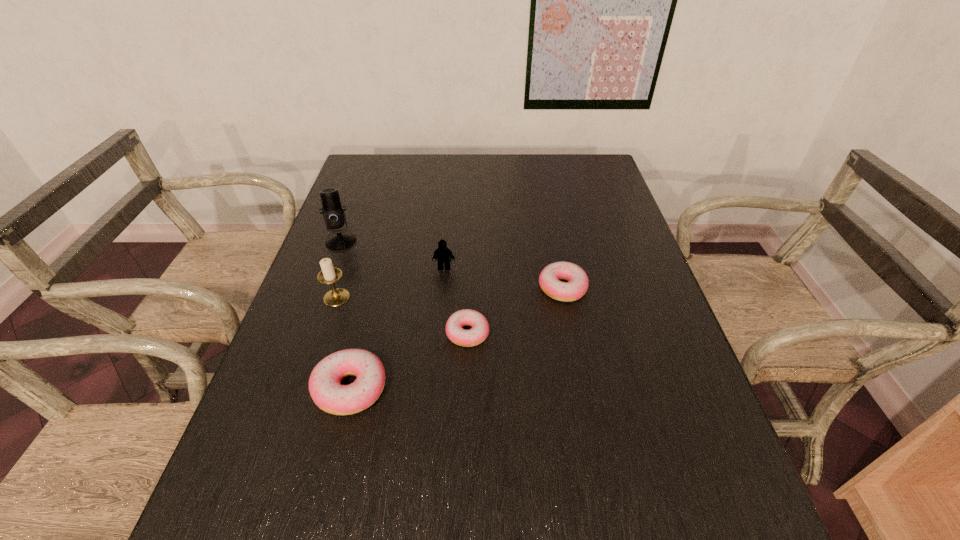
Find the location of a particular element. The height and width of the screenshot is (540, 960). the fifth nearest object is located at coordinates (442, 255).

The image size is (960, 540). What are the coordinates of `vacant area located 0.240m on the right of the nearest doughnut` in the screenshot? It's located at (503, 389).

Where is `free space located on the front of the second doughnut from right to left`? The image size is (960, 540). free space located on the front of the second doughnut from right to left is located at coordinates (466, 406).

What are the coordinates of `free space located on the front of the second shortest object` in the screenshot? It's located at (592, 442).

Find the location of a particular element. vacant space located on the back of the candle holder is located at coordinates (357, 235).

At what (x,y) coordinates should I click in order to perform the action: click on vacant point located 0.070m on the stand of the tallest object. Please return your answer as a coordinate pair (x, y). The image size is (960, 540). Looking at the image, I should click on (331, 267).

At what (x,y) coordinates should I click in order to perform the action: click on vacant area located 0.100m on the face of the second farthest object. Please return your answer as a coordinate pair (x, y). Looking at the image, I should click on (442, 297).

Find the location of a particular element. This screenshot has height=540, width=960. doughnut that is positioned at the left edge is located at coordinates (329, 395).

At what (x,y) coordinates should I click in order to perform the action: click on candle holder located at the left edge. Please return your answer as a coordinate pair (x, y). The height and width of the screenshot is (540, 960). Looking at the image, I should click on (337, 296).

Where is `microphone situated at the left edge`? microphone situated at the left edge is located at coordinates (333, 213).